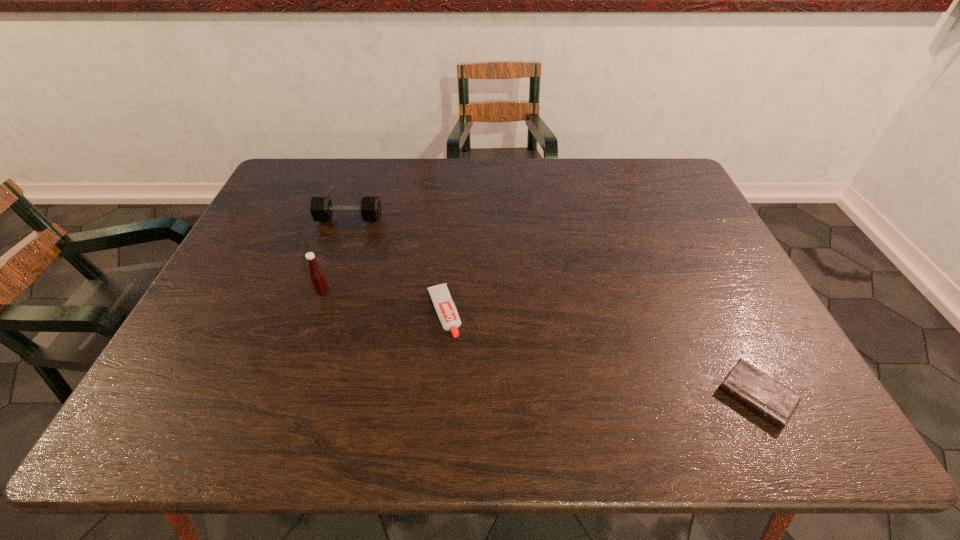
Locate an element on the screen. object that ranks as the second closest to the Tabasco sauce is located at coordinates (445, 308).

Find the location of a particular element. This screenshot has width=960, height=540. free location that satisfies the following two spatial constraints: 1. on the front side of the second object from right to left; 2. on the right side of the farthest object is located at coordinates (318, 313).

Locate an element on the screen. vacant point that satisfies the following two spatial constraints: 1. on the front side of the Tabasco sauce; 2. on the right side of the nearest object is located at coordinates [x=286, y=396].

What are the coordinates of `blank space that satisfies the following two spatial constraints: 1. on the front side of the second tallest object; 2. on the right side of the shortest object` in the screenshot? It's located at (289, 396).